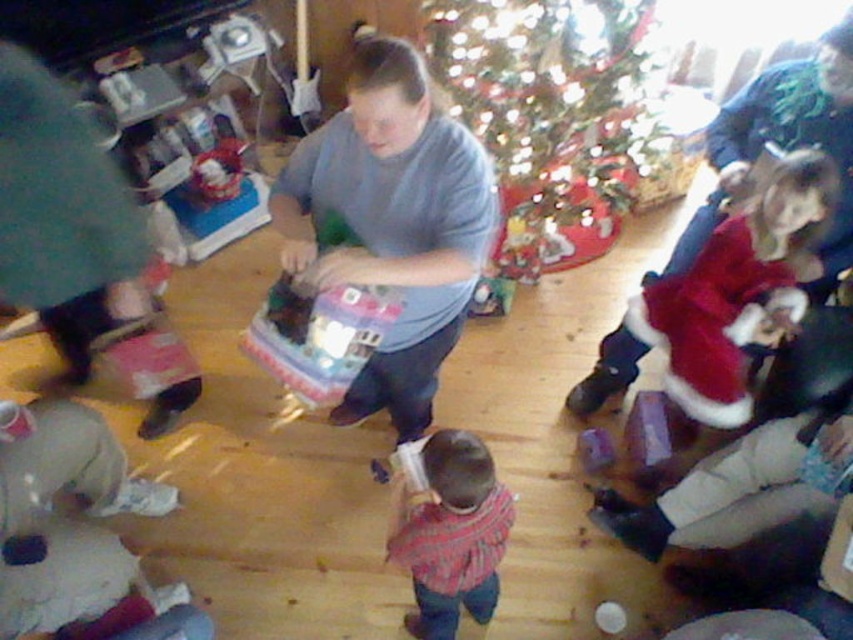
Question: Is green glittering christmas tree at upper center bigger than velvet red santa hat at lower left?

Choices:
 (A) no
 (B) yes

Answer: (B)

Question: Which object is closer to the camera taking this photo?

Choices:
 (A) matte gray shirt at center
 (B) fuzzy red dress at lower right

Answer: (A)

Question: Is fuzzy red dress at lower right to the right of plaid shirt at center from the viewer's perspective?

Choices:
 (A) no
 (B) yes

Answer: (B)

Question: Is green glittering christmas tree at upper center to the left of plaid shirt at center from the viewer's perspective?

Choices:
 (A) yes
 (B) no

Answer: (B)

Question: Which object appears farthest from the camera in this image?

Choices:
 (A) matte gray shirt at center
 (B) fuzzy red dress at lower right
 (C) plaid shirt at center

Answer: (B)

Question: Considering the real-world distances, which object is closest to the velvet red santa hat at lower left?

Choices:
 (A) green glittering christmas tree at upper center
 (B) plaid shirt at center

Answer: (B)